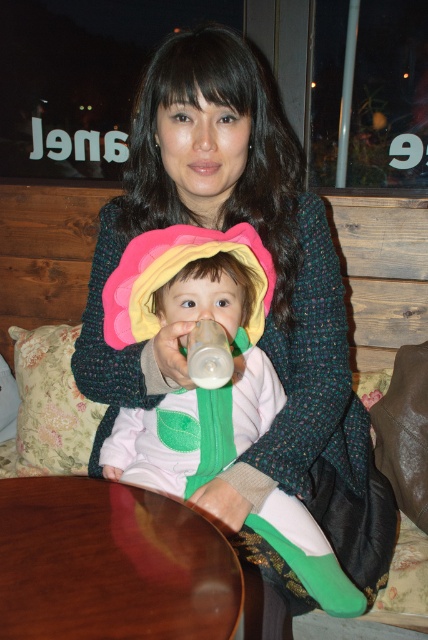
Question: Which object appears closest to the camera in this image?

Choices:
 (A) soft pink fabric flower at center
 (B) transparent plastic bottle at center

Answer: (B)

Question: Is soft pink fabric flower at center thinner than shiny brown wood at lower center?

Choices:
 (A) no
 (B) yes

Answer: (A)

Question: Which point is closer to the camera?

Choices:
 (A) shiny brown wood at lower center
 (B) soft pink fabric flower at center

Answer: (A)

Question: Can you confirm if soft pink fabric flower at center is wider than transparent plastic bottle at center?

Choices:
 (A) yes
 (B) no

Answer: (A)

Question: From the image, what is the correct spatial relationship of shiny brown wood at lower center in relation to transparent plastic bottle at center?

Choices:
 (A) right
 (B) left

Answer: (B)

Question: Which point is farther from the camera taking this photo?

Choices:
 (A) (33, 508)
 (B) (193, 369)
 (C) (166, 262)

Answer: (A)